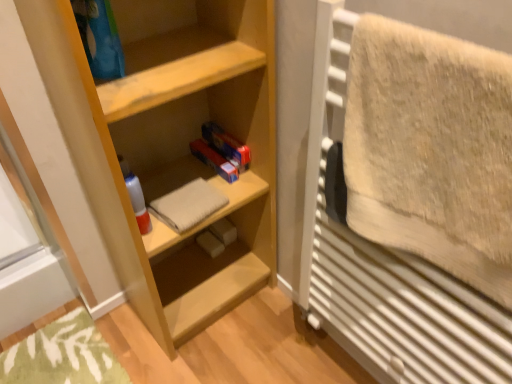
Question: Does light wood shelf at center have a smaller size compared to beige fluffy towel at right, acting as the 1th bath towel starting from the right?

Choices:
 (A) no
 (B) yes

Answer: (A)

Question: Can you confirm if light wood shelf at center is wider than beige fluffy towel at right, which ranks as the 1th bath towel in front-to-back order?

Choices:
 (A) no
 (B) yes

Answer: (B)

Question: Can you confirm if light wood shelf at center is taller than beige fluffy towel at right, which appears as the second bath towel when viewed from the left?

Choices:
 (A) yes
 (B) no

Answer: (A)

Question: Is the depth of light wood shelf at center greater than that of beige fluffy towel at right, which is the 2th bath towel in back-to-front order?

Choices:
 (A) no
 (B) yes

Answer: (B)

Question: Can you see light wood shelf at center touching beige fluffy towel at right, which ranks as the 1th bath towel in front-to-back order?

Choices:
 (A) yes
 (B) no

Answer: (B)

Question: In the image, is beige cotton towel at center, acting as the 2th bath towel starting from the front, positioned in front of or behind light wood shelf at center?

Choices:
 (A) front
 (B) behind

Answer: (B)

Question: Do you think beige cotton towel at center, acting as the 2th bath towel starting from the front, is within light wood shelf at center, or outside of it?

Choices:
 (A) inside
 (B) outside

Answer: (A)

Question: Based on their sizes in the image, would you say beige cotton towel at center, acting as the 2th bath towel starting from the front, is bigger or smaller than light wood shelf at center?

Choices:
 (A) big
 (B) small

Answer: (B)

Question: Is point (181, 205) closer or farther from the camera than point (187, 51)?

Choices:
 (A) farther
 (B) closer

Answer: (A)

Question: Do you think light wood shelf at center is within beige cotton towel at center, acting as the 2th bath towel starting from the front, or outside of it?

Choices:
 (A) inside
 (B) outside

Answer: (B)

Question: Is point (106, 92) closer or farther from the camera than point (160, 200)?

Choices:
 (A) farther
 (B) closer

Answer: (B)

Question: Visually, is light wood shelf at center positioned to the left or to the right of beige cotton towel at center, which is counted as the first bath towel, starting from the back?

Choices:
 (A) left
 (B) right

Answer: (B)

Question: Is light wood shelf at center in front of or behind beige cotton towel at center, the 2th bath towel viewed from the right, in the image?

Choices:
 (A) behind
 (B) front

Answer: (B)

Question: Considering the relative positions of beige fluffy towel at right, which is the 2th bath towel in back-to-front order, and light wood shelf at center in the image provided, is beige fluffy towel at right, which is the 2th bath towel in back-to-front order, to the left or to the right of light wood shelf at center?

Choices:
 (A) right
 (B) left

Answer: (A)

Question: In terms of width, does beige fluffy towel at right, which is the 2th bath towel in back-to-front order, look wider or thinner when compared to light wood shelf at center?

Choices:
 (A) wide
 (B) thin

Answer: (B)